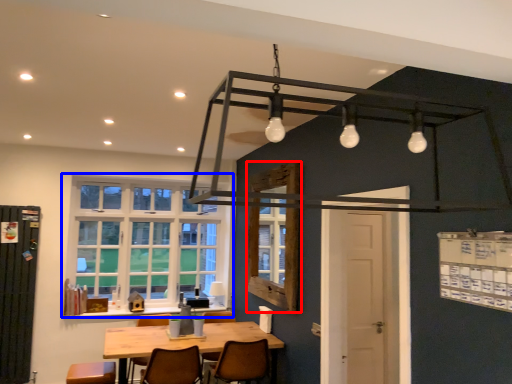
Question: Which point is further to the camera, window (highlighted by a red box) or window (highlighted by a blue box)?

Choices:
 (A) window
 (B) window

Answer: (B)